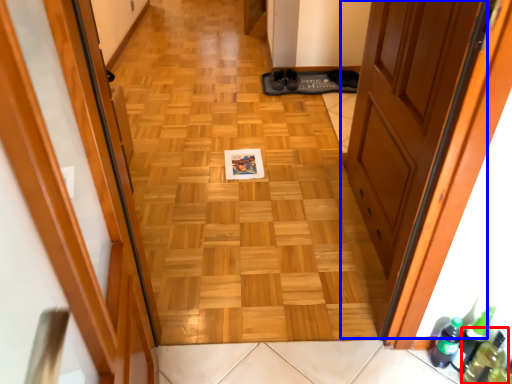
Question: Which object is further to the camera taking this photo, bottle (highlighted by a red box) or door (highlighted by a blue box)?

Choices:
 (A) bottle
 (B) door

Answer: (A)